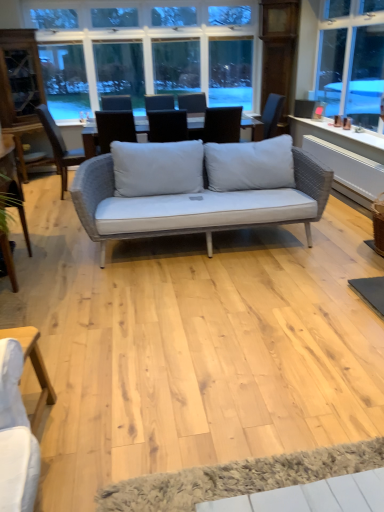
Question: Is light wood table at lower left far from white textured yoga mat at lower center?

Choices:
 (A) no
 (B) yes

Answer: (A)

Question: Is light wood table at lower left at the left side of white textured yoga mat at lower center?

Choices:
 (A) no
 (B) yes

Answer: (B)

Question: Is light wood table at lower left bigger than white textured yoga mat at lower center?

Choices:
 (A) yes
 (B) no

Answer: (A)

Question: From a real-world perspective, is light wood table at lower left physically below white textured yoga mat at lower center?

Choices:
 (A) yes
 (B) no

Answer: (B)

Question: Is light wood table at lower left oriented away from white textured yoga mat at lower center?

Choices:
 (A) yes
 (B) no

Answer: (B)

Question: Is clear glass window at upper center inside or outside of matte gray cushion at center, the 2th chair viewed from the left?

Choices:
 (A) outside
 (B) inside

Answer: (A)

Question: Is point (69, 5) positioned closer to the camera than point (168, 121)?

Choices:
 (A) closer
 (B) farther

Answer: (B)

Question: Considering the positions of clear glass window at upper center and matte gray cushion at center, the 2th chair viewed from the left, in the image, is clear glass window at upper center bigger or smaller than matte gray cushion at center, the 2th chair viewed from the left,?

Choices:
 (A) big
 (B) small

Answer: (A)

Question: From the image's perspective, is clear glass window at upper center located above or below matte gray cushion at center, arranged as the 1th chair when viewed from the right?

Choices:
 (A) below
 (B) above

Answer: (B)

Question: Is matte gray cushion at center, arranged as the 1th chair when viewed from the right, in front of or behind light wood table at lower left in the image?

Choices:
 (A) front
 (B) behind

Answer: (B)

Question: From a real-world perspective, is matte gray cushion at center, arranged as the 1th chair when viewed from the right, physically located above or below light wood table at lower left?

Choices:
 (A) above
 (B) below

Answer: (A)

Question: In terms of height, does matte gray cushion at center, the 2th chair viewed from the left, look taller or shorter compared to light wood table at lower left?

Choices:
 (A) short
 (B) tall

Answer: (A)

Question: Is matte gray cushion at center, the 2th chair viewed from the left, wider or thinner than light wood table at lower left?

Choices:
 (A) thin
 (B) wide

Answer: (B)

Question: Does point (66, 173) appear closer or farther from the camera than point (304, 108)?

Choices:
 (A) farther
 (B) closer

Answer: (B)

Question: Which is correct: woven fabric chair at center, positioned as the second chair in right-to-left order, is inside matte gray wicker armchair at upper right, or outside of it?

Choices:
 (A) outside
 (B) inside

Answer: (A)